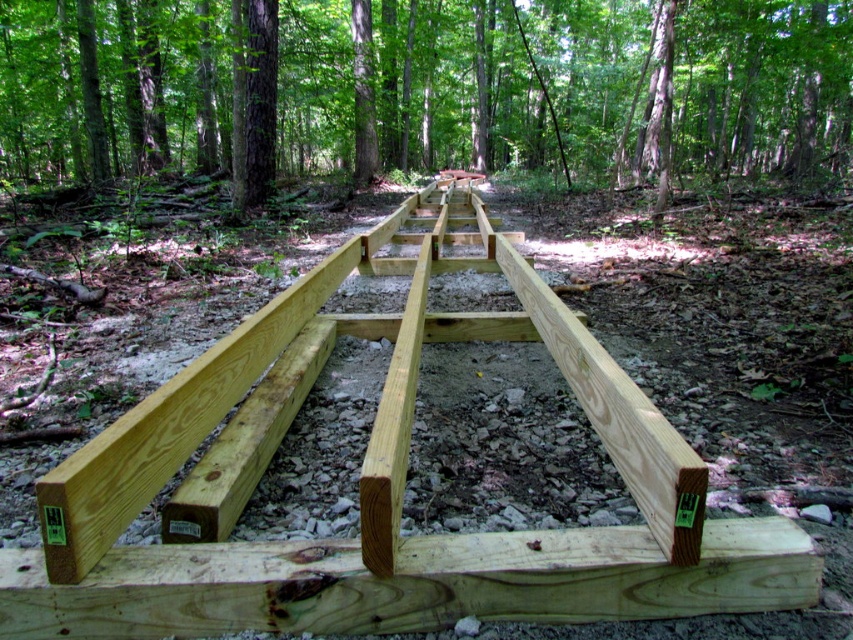
Question: Which object is closer to the camera taking this photo?

Choices:
 (A) green wood planks at center
 (B) natural wood rail at center

Answer: (B)

Question: Which point is farther to the camera?

Choices:
 (A) (587, 136)
 (B) (422, 260)

Answer: (A)

Question: Observing the image, what is the correct spatial positioning of green wood planks at center in reference to natural wood rail at center?

Choices:
 (A) right
 (B) left

Answer: (A)

Question: Does green wood planks at center have a larger size compared to natural wood rail at center?

Choices:
 (A) yes
 (B) no

Answer: (A)

Question: Can you confirm if green wood planks at center is positioned above natural wood rail at center?

Choices:
 (A) no
 (B) yes

Answer: (B)